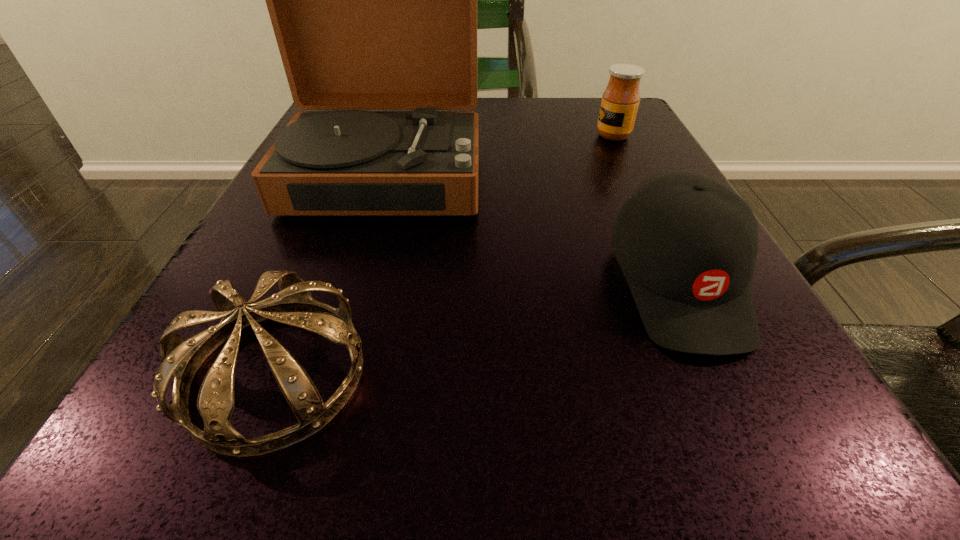
The height and width of the screenshot is (540, 960). Find the location of `phonograph record that is at the far edge`. phonograph record that is at the far edge is located at coordinates (373, 0).

You are a GUI agent. You are given a task and a screenshot of the screen. Output one action in this format:
    pyautogui.click(x=<x>, y=<y>)
    Task: Click on the honey that is at the far edge
    The image size is (960, 540).
    Given the screenshot: What is the action you would take?
    620,100

The width and height of the screenshot is (960, 540). Identify the location of object situated at the near edge. (293, 305).

Locate an element on the screen. phonograph record that is at the left edge is located at coordinates (373, 0).

Locate an element on the screen. The height and width of the screenshot is (540, 960). tiara that is positioned at the left edge is located at coordinates (293, 305).

The image size is (960, 540). I want to click on honey present at the right edge, so click(620, 100).

What are the coordinates of `baseball cap that is at the right edge` in the screenshot? It's located at (687, 244).

Where is `object that is positioned at the far left corner`? The height and width of the screenshot is (540, 960). object that is positioned at the far left corner is located at coordinates (373, 0).

Identify the location of object located at the near left corner. The height and width of the screenshot is (540, 960). (293, 305).

At what (x,y) coordinates should I click in order to perform the action: click on object that is at the far right corner. Please return your answer as a coordinate pair (x, y). This screenshot has width=960, height=540. Looking at the image, I should click on (620, 100).